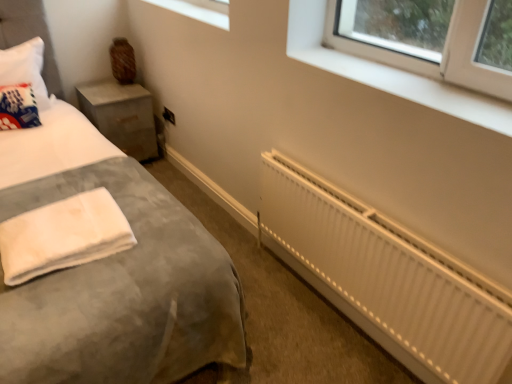
Find the location of a particular element. The height and width of the screenshot is (384, 512). free point above concrete textured nightstand at left (from a real-world perspective) is located at coordinates (106, 87).